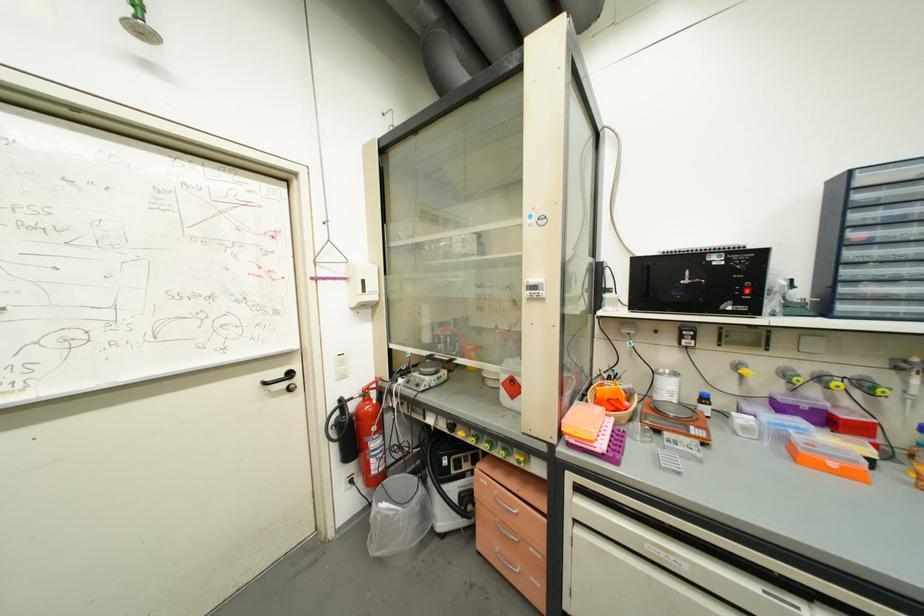
Find where to pull the emergency shower handle. Please return your answer as a coordinate pair (x, y).

(283, 379)